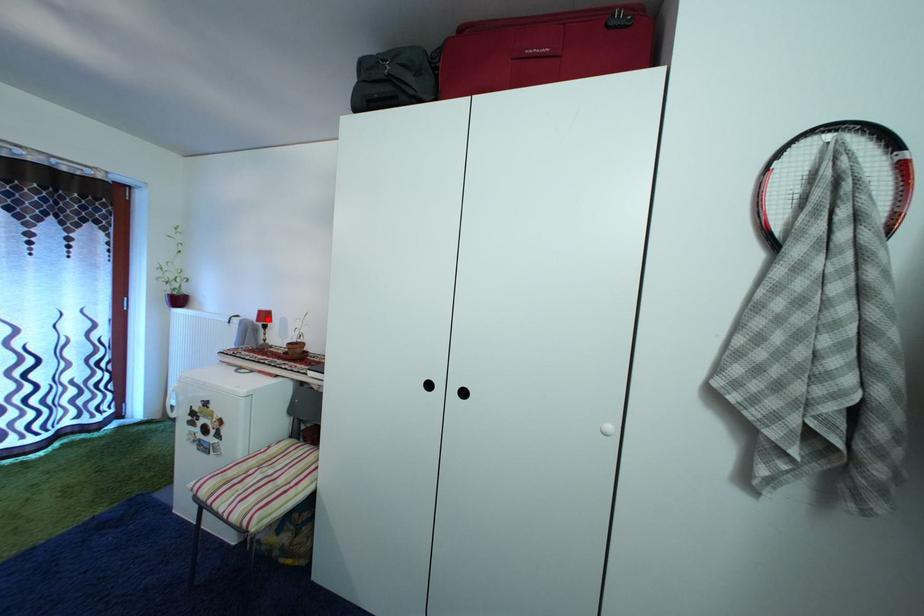
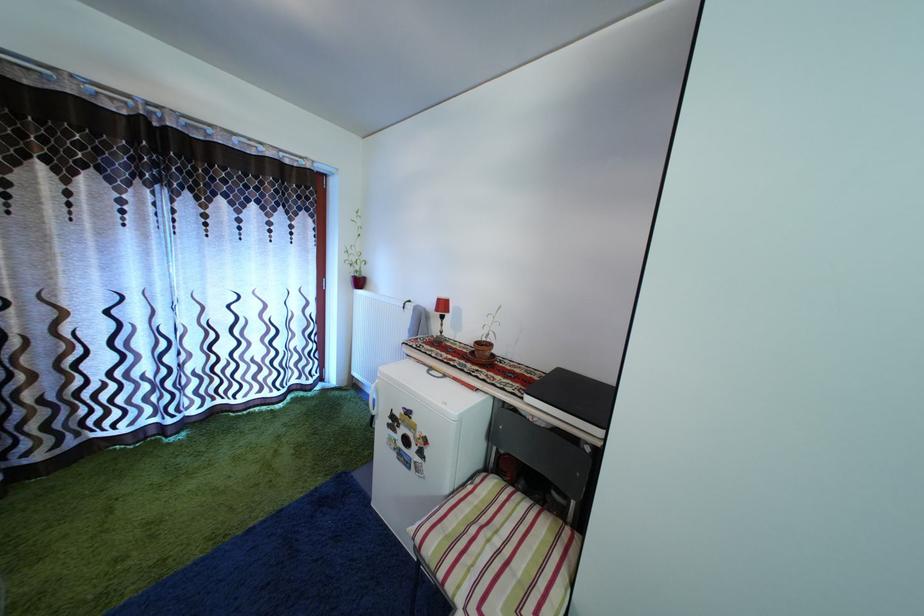
Locate, in the second image, the point that corresponds to the highlighted location in the first image.

(446, 308)